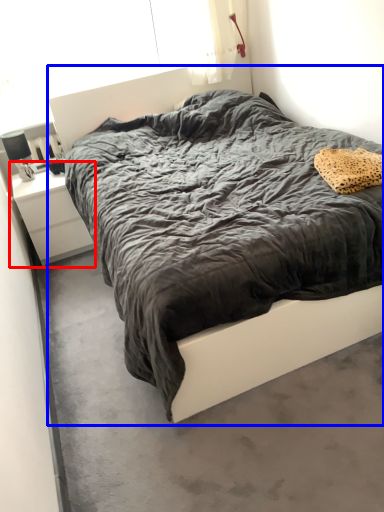
Question: Which object is closer to the camera taking this photo, nightstand (highlighted by a red box) or bed (highlighted by a blue box)?

Choices:
 (A) nightstand
 (B) bed

Answer: (B)